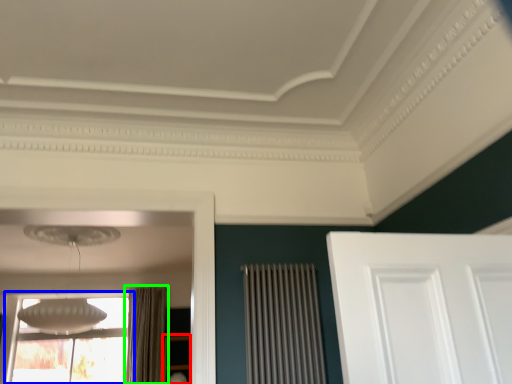
Question: Considering the real-world distances, which object is closest to furniture (highlighted by a red box)? window (highlighted by a blue box) or curtain (highlighted by a green box).

Choices:
 (A) window
 (B) curtain

Answer: (B)